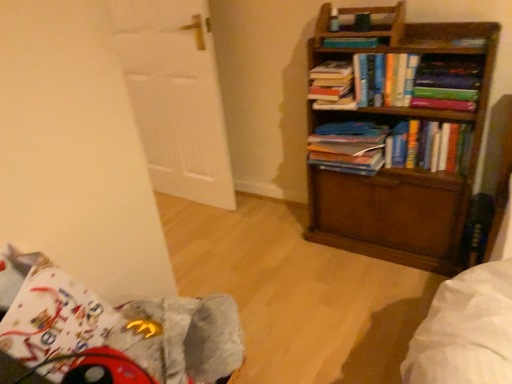
Question: Considering the positions of point (324, 41) and point (308, 170), is point (324, 41) closer or farther from the camera than point (308, 170)?

Choices:
 (A) farther
 (B) closer

Answer: (B)

Question: From the image's perspective, is hardcover book at upper center, the fifth book positioned from the bottom, positioned above or below wooden bookcase at right?

Choices:
 (A) below
 (B) above

Answer: (B)

Question: Estimate the real-world distances between objects in this image. Which object is closer to the hardcover books at center, the 1th book from the bottom?

Choices:
 (A) hardcover books at upper center, the 3th book positioned from the top
 (B) blue matte book at center, the 4th book viewed from the top
 (C) fuzzy fabric swivel chair at lower left
 (D) hardcover book at upper right
 (E) wooden bookcase at right

Answer: (D)

Question: Which is farther from the fuzzy fabric swivel chair at lower left?

Choices:
 (A) wooden bookcase at right
 (B) hardcover book at upper center, marked as the 4th book in a bottom-to-top arrangement
 (C) hardcover books at upper center, acting as the third book starting from the bottom
 (D) hardcover book at upper center, the fifth book positioned from the bottom
 (E) blue matte book at center, which is the second book in bottom-to-top order

Answer: (D)